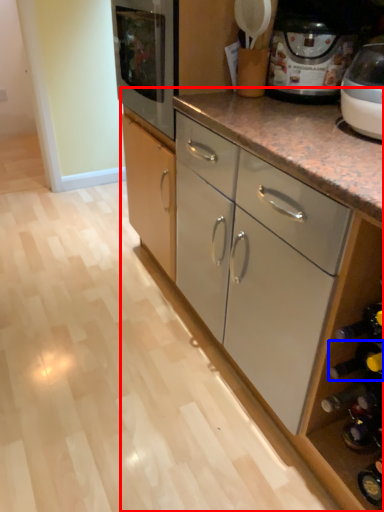
Question: Which point is further to the camera, cabinetry (highlighted by a red box) or wine bottle (highlighted by a blue box)?

Choices:
 (A) cabinetry
 (B) wine bottle

Answer: (A)